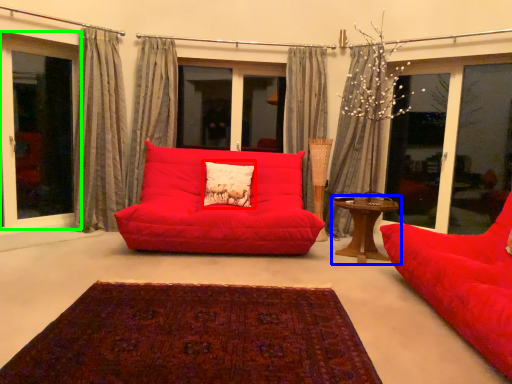
Question: Which object is positioned farthest from pillow (highlighted by a red box)? Select from table (highlighted by a blue box) and window (highlighted by a green box).

Choices:
 (A) table
 (B) window

Answer: (B)